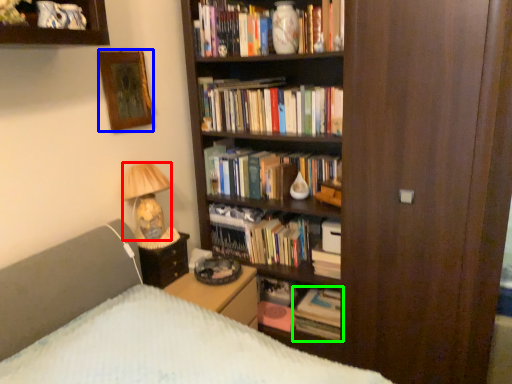
Question: Estimate the real-world distances between objects in this image. Which object is farther from lamp (highlighted by a red box), picture frame (highlighted by a blue box) or book (highlighted by a green box)?

Choices:
 (A) picture frame
 (B) book

Answer: (B)